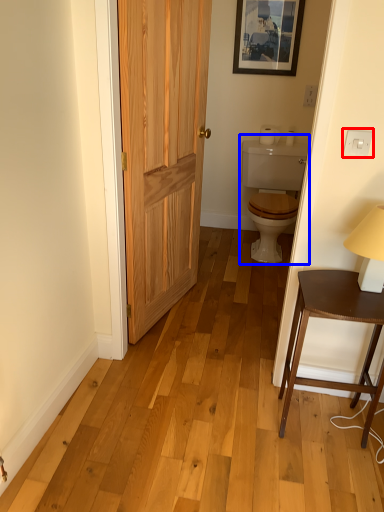
Question: Which object appears farthest to the camera in this image, electric outlet (highlighted by a red box) or sink (highlighted by a blue box)?

Choices:
 (A) electric outlet
 (B) sink

Answer: (B)